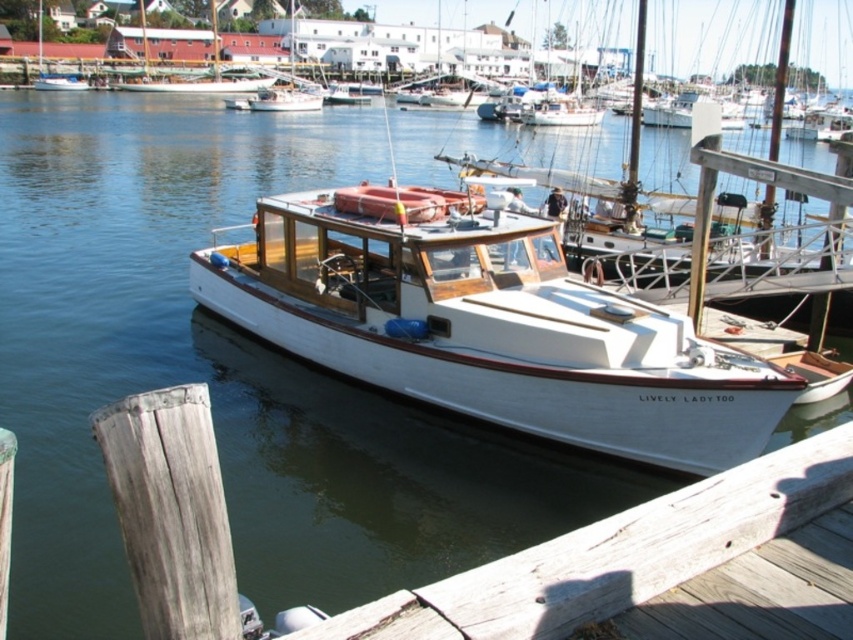
Which is behind, point (666, 586) or point (54, 77)?

The point (54, 77) is behind.

Between point (844, 490) and point (61, 76), which one is positioned in front?

Point (844, 490) is in front.

Between point (451, 618) and point (39, 86), which one is positioned in front?

Point (451, 618)

Find the location of a particular element. The width and height of the screenshot is (853, 640). wooden planks at lower center is located at coordinates (614, 554).

Which is in front, point (474, 236) or point (546, 589)?

Point (546, 589) is in front.

Which is above, white polished wood boat at center or wooden planks at lower center?

Positioned higher is wooden planks at lower center.

Is point (440, 282) closer to camera compared to point (344, 632)?

No.

At what (x,y) coordinates should I click in order to perform the action: click on white polished wood boat at center. Please return your answer as a coordinate pair (x, y). Looking at the image, I should click on (488, 326).

Does white wood boat at center have a smaller size compared to white glossy boat at center?

Incorrect, white wood boat at center is not smaller in size than white glossy boat at center.

Does white wood boat at center have a greater width compared to white glossy boat at center?

Incorrect, white wood boat at center's width does not surpass white glossy boat at center's.

Is point (317, 97) in front of point (57, 83)?

Yes, it is.

This screenshot has height=640, width=853. I want to click on white wood boat at center, so click(x=283, y=100).